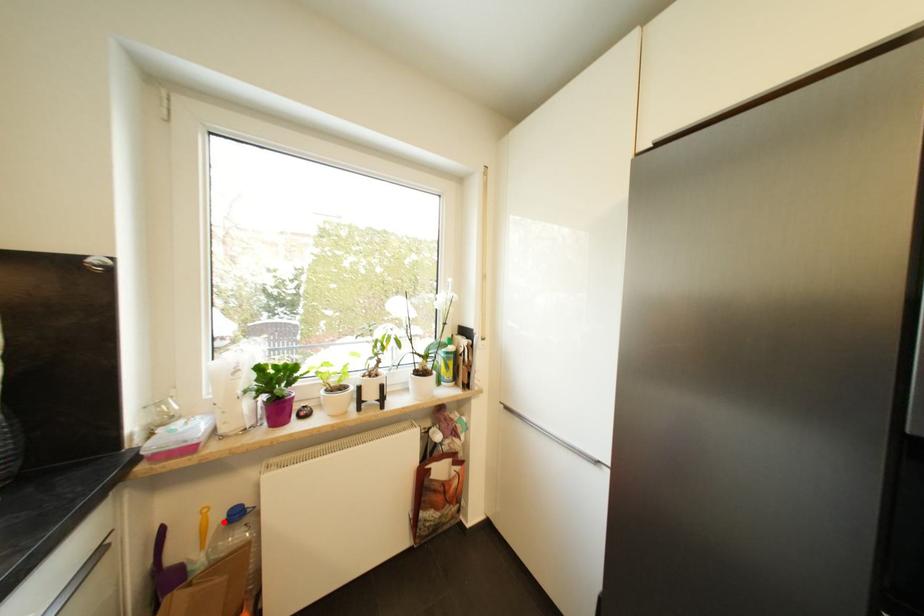
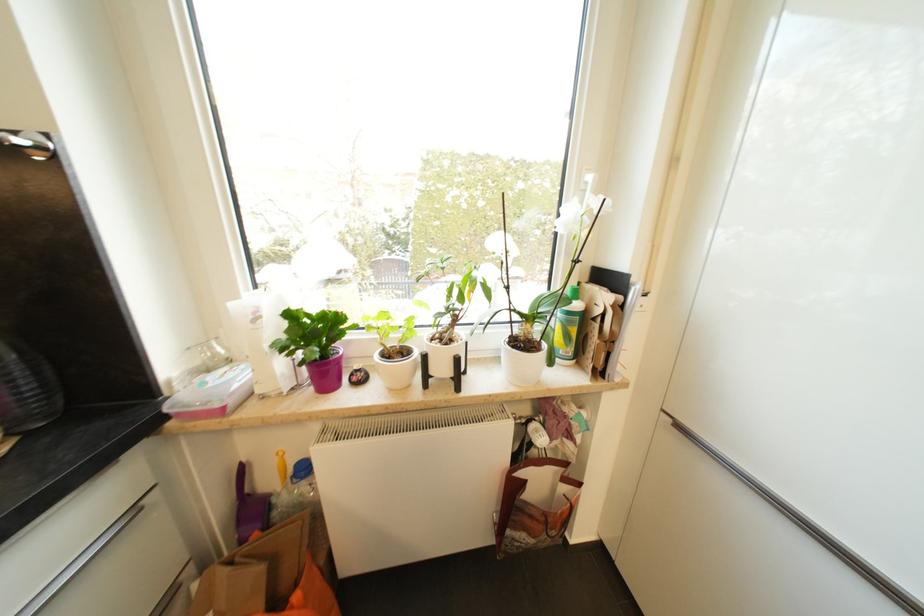
Locate, in the second image, the point that corresponds to the highlighted location in the first image.

(295, 471)